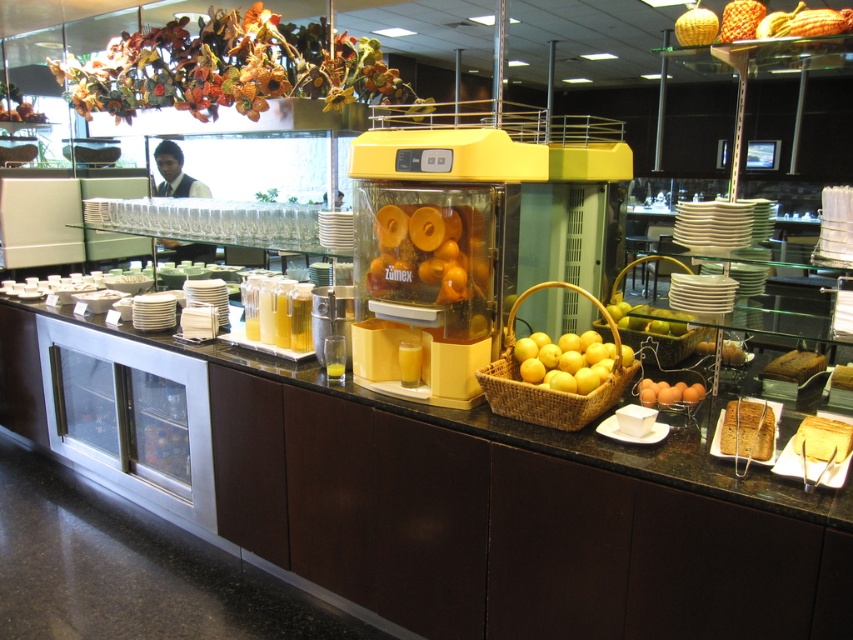
You are a customer at the buffet station and want to grab some lemons. Where exactly are the yellow matte lemons at center located?

The yellow matte lemons at center are located at point (564, 362).